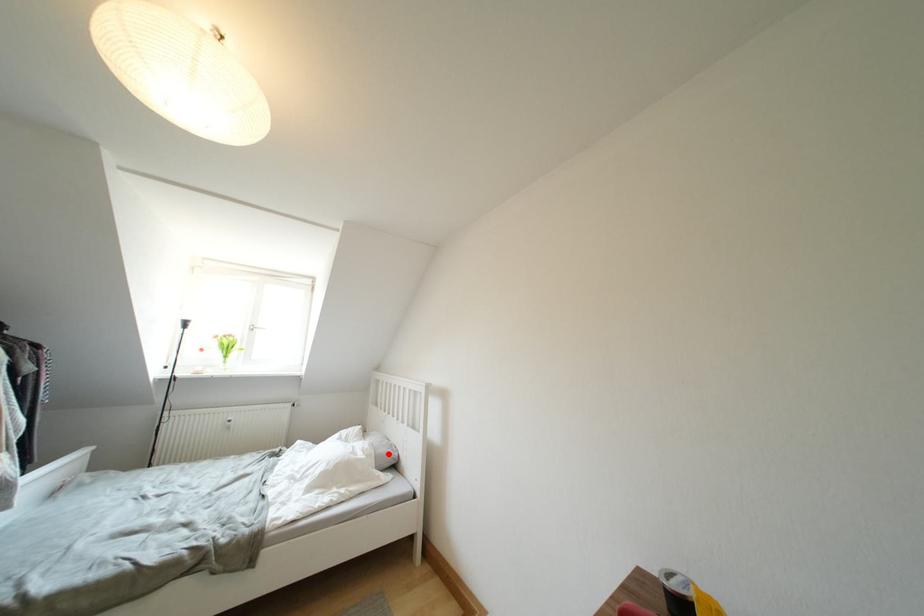
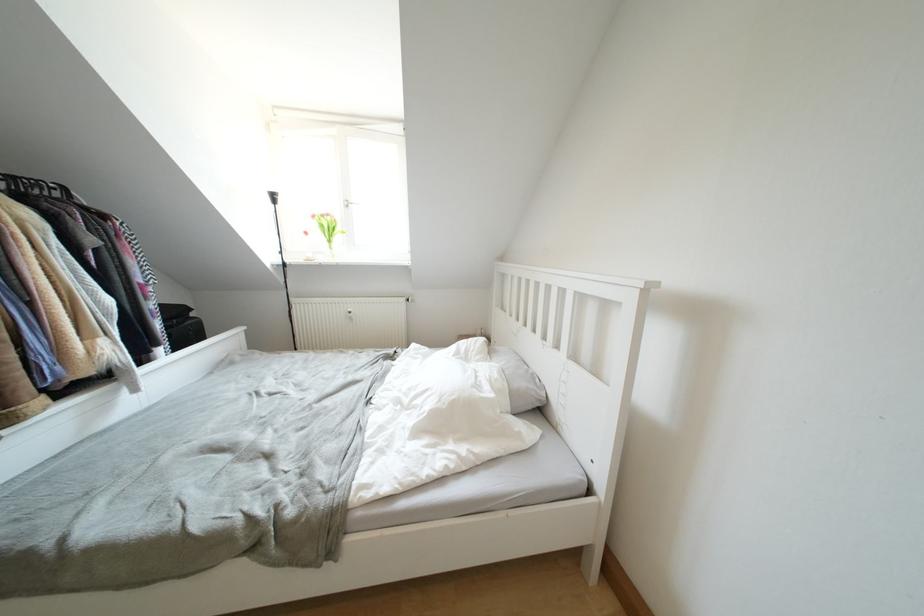
Question: I am providing you with two images of the same scene from different viewpoints. A red point is shown in image1. For the corresponding object point in image2, is it positioned nearer or farther from the camera?

Choices:
 (A) Nearer
 (B) Farther

Answer: (A)